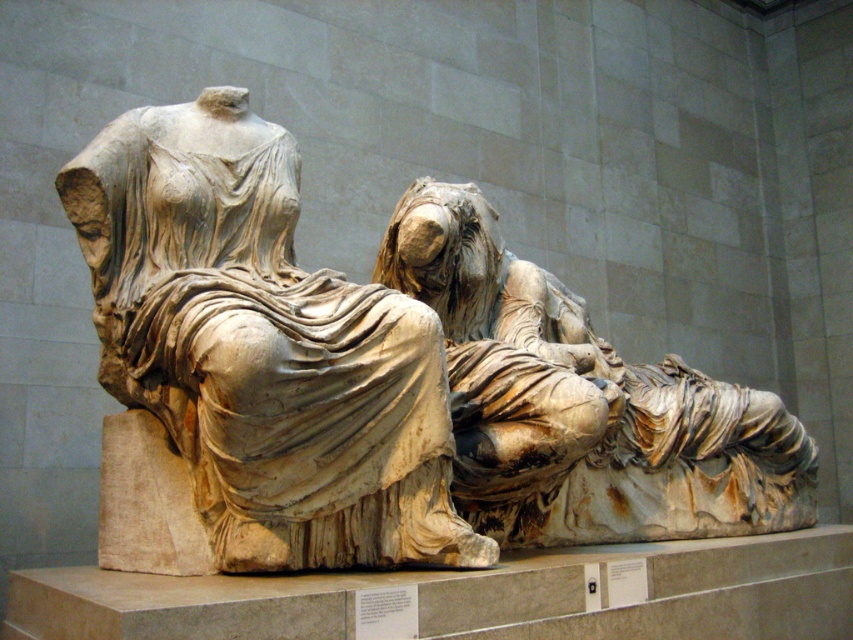
Does white marble statue at left have a smaller size compared to marble statue at center?

Indeed, white marble statue at left has a smaller size compared to marble statue at center.

From the picture: Is white marble statue at left wider than marble statue at center?

Incorrect, white marble statue at left's width does not surpass marble statue at center's.

Measure the distance between point (x=274, y=540) and camera.

Point (x=274, y=540) is 59.12 feet from camera.

Find the location of a particular element. white marble statue at left is located at coordinates (263, 348).